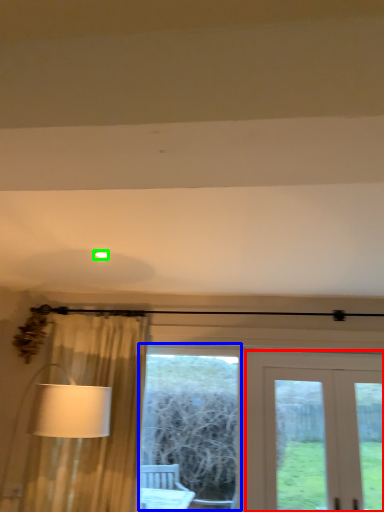
Question: Estimate the real-world distances between objects in this image. Which object is farther from door (highlighted by a red box), bay window (highlighted by a blue box) or lighting (highlighted by a green box)?

Choices:
 (A) bay window
 (B) lighting

Answer: (B)